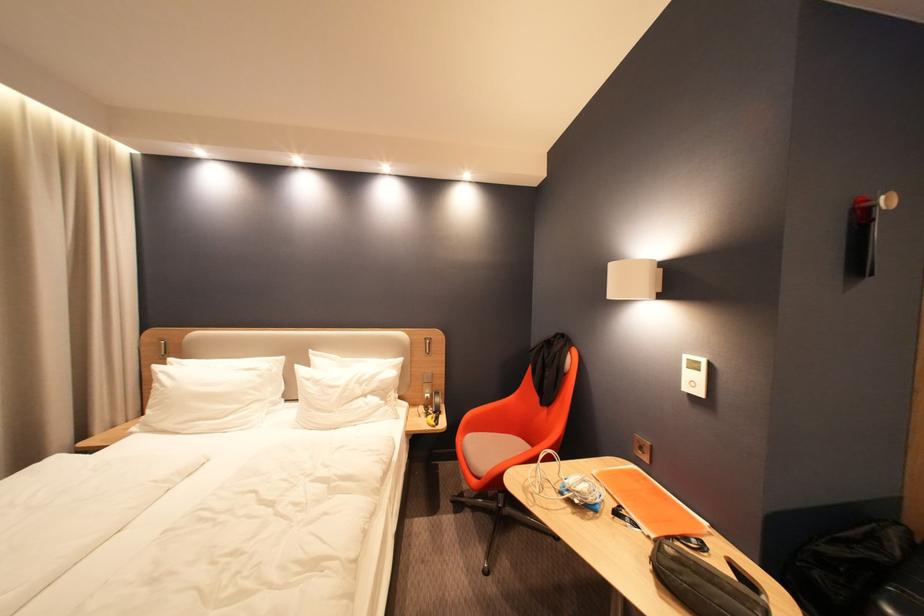
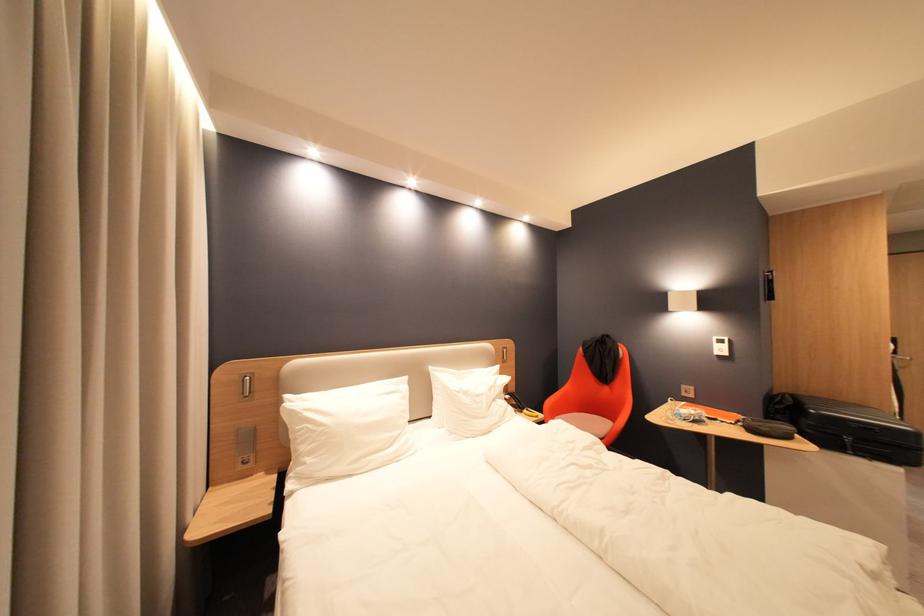
Question: In a continuous first-person perspective shot, in which direction is the camera moving?

Choices:
 (A) Left
 (B) Right
 (C) Forward
 (D) Backward

Answer: (A)